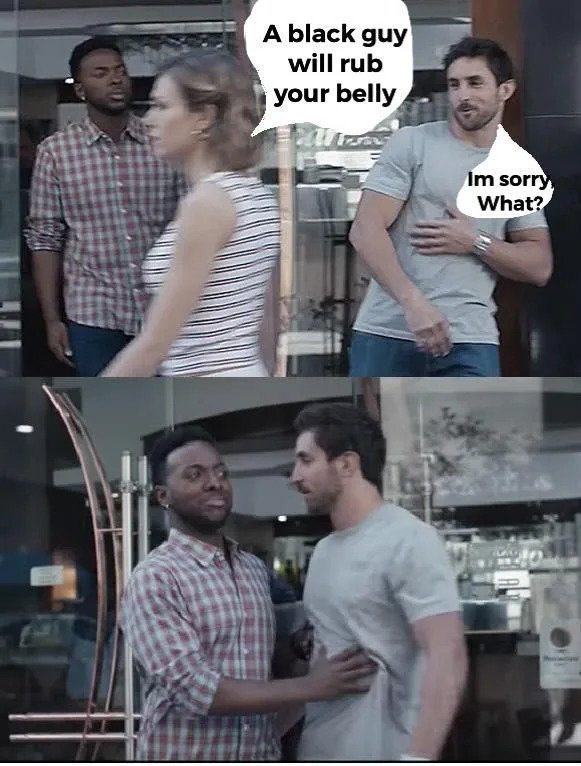
Find the location of a particular element. The width and height of the screenshot is (581, 766). coffee machine is located at coordinates (520, 565), (520, 548).